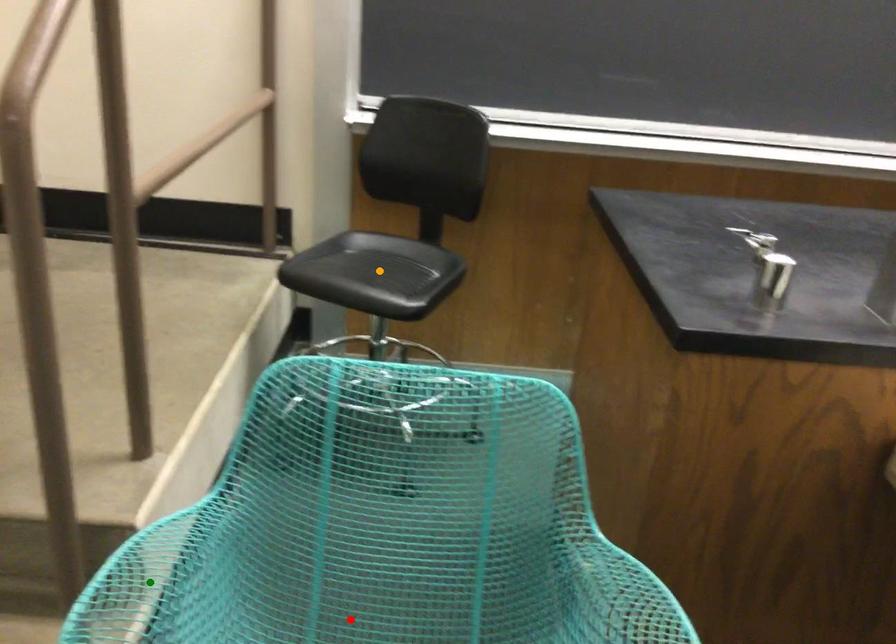
Order these from nearest to farthest:
green point
red point
orange point

green point < red point < orange point